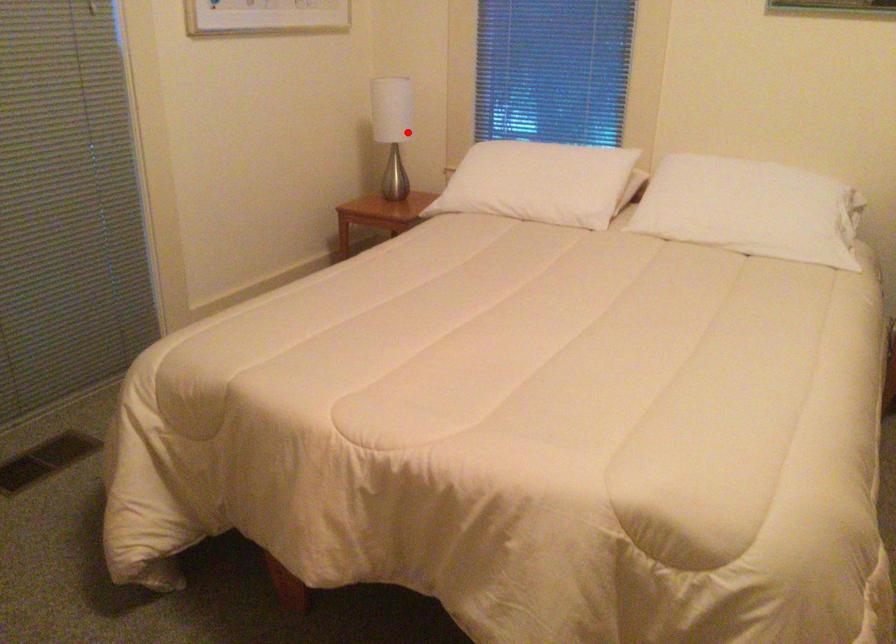
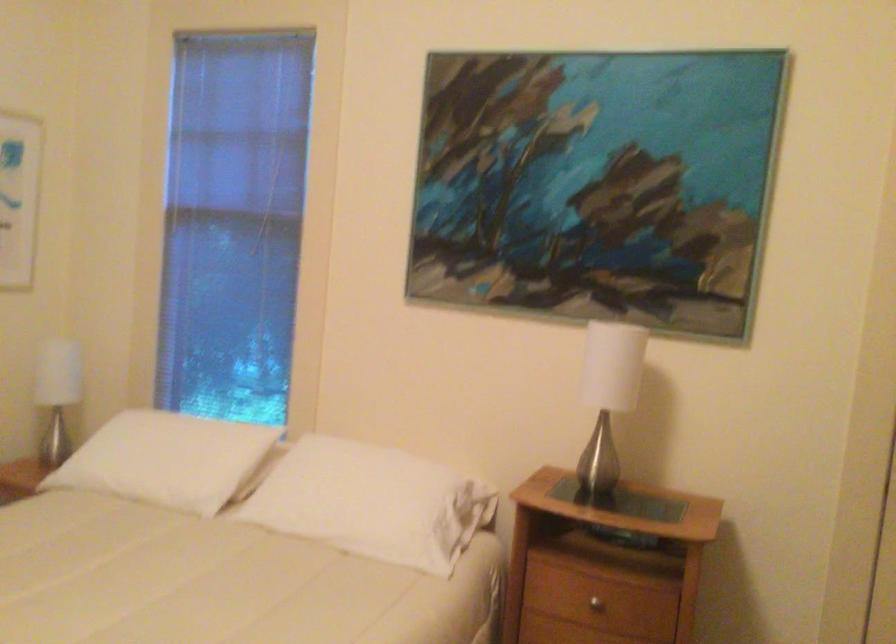
Question: I am providing you with two images of the same scene from different viewpoints. Given a red point in image1, look at the same physical point in image2. Is it:

Choices:
 (A) Closer to the viewpoint
 (B) Farther from the viewpoint

Answer: (A)